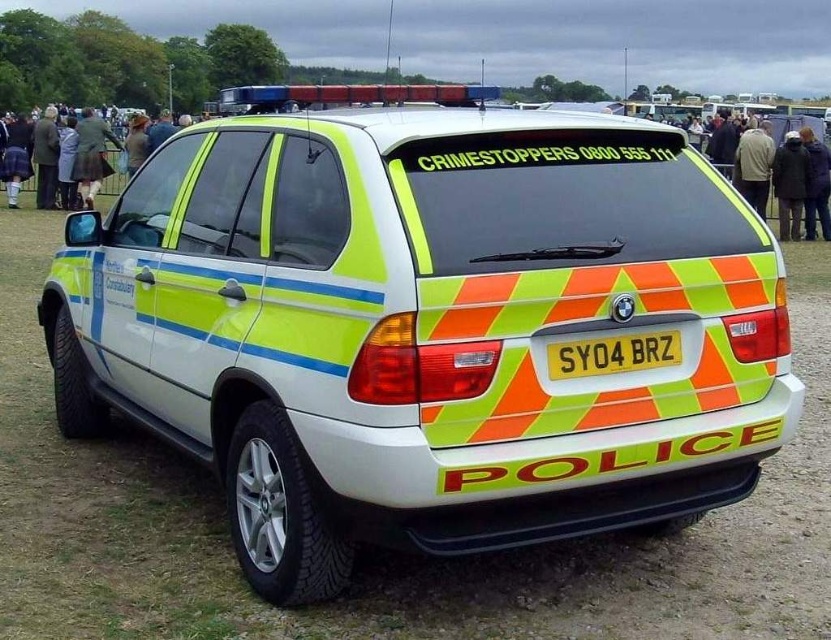
Question: Which of the following is the farthest from the observer?

Choices:
 (A) coord(130,164)
 (B) coord(805,170)
 (C) coord(817,189)

Answer: (A)

Question: Does dark brown leather coat at right appear on the right side of brown leather jacket at upper center?

Choices:
 (A) no
 (B) yes

Answer: (B)

Question: Which object appears farthest from the camera in this image?

Choices:
 (A) dark brown leather jacket at center
 (B) reflective fluorescent police car at center
 (C) yellow plastic license plate at rear
 (D) brown leather jacket at upper center

Answer: (D)

Question: Is dark brown leather jacket at center below brown leather jacket at upper center?

Choices:
 (A) no
 (B) yes

Answer: (B)

Question: Is reflective fluorescent police car at center positioned in front of dark brown leather jacket at center?

Choices:
 (A) yes
 (B) no

Answer: (A)

Question: Which point is closer to the camera taking this photo?

Choices:
 (A) (574, 362)
 (B) (812, 156)
 (C) (785, 177)

Answer: (A)